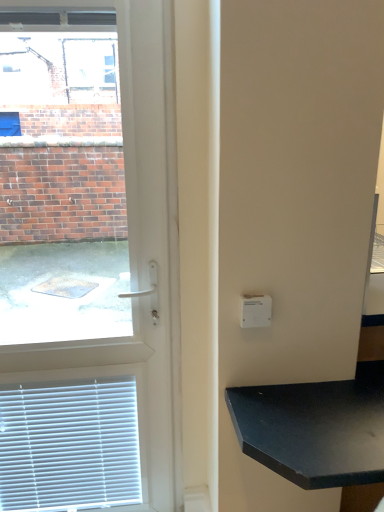
The height and width of the screenshot is (512, 384). In order to click on empty space that is ontop of black matte table at lower right (from a real-world perspective) in this screenshot , I will do `click(330, 407)`.